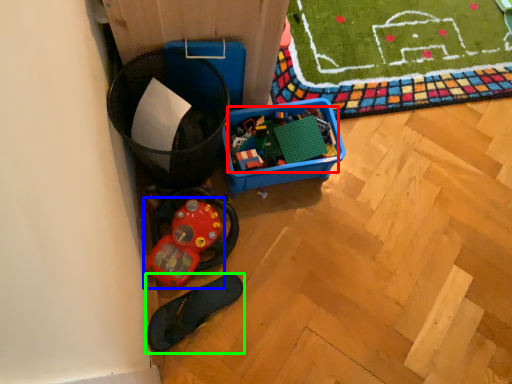
Question: Based on their relative distances, which object is nearer to toy (highlighted by a red box)? Choose from toy (highlighted by a blue box) and footwear (highlighted by a green box).

Choices:
 (A) toy
 (B) footwear

Answer: (A)